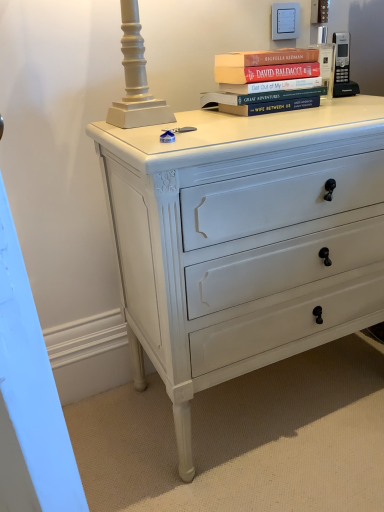
Question: Can you confirm if black plastic phone at upper right is positioned to the right of white painted wood chest of drawers at center?

Choices:
 (A) no
 (B) yes

Answer: (B)

Question: From the image's perspective, is black plastic phone at upper right below white painted wood chest of drawers at center?

Choices:
 (A) yes
 (B) no

Answer: (B)

Question: Would you say black plastic phone at upper right contains white painted wood chest of drawers at center?

Choices:
 (A) yes
 (B) no

Answer: (B)

Question: From the image's perspective, is black plastic phone at upper right located above white painted wood chest of drawers at center?

Choices:
 (A) yes
 (B) no

Answer: (A)

Question: Is black plastic phone at upper right positioned with its back to white painted wood chest of drawers at center?

Choices:
 (A) yes
 (B) no

Answer: (B)

Question: Is point (337, 91) closer or farther from the camera than point (309, 53)?

Choices:
 (A) farther
 (B) closer

Answer: (A)

Question: Based on their sizes in the image, would you say black plastic phone at upper right is bigger or smaller than hardcover books at upper center?

Choices:
 (A) big
 (B) small

Answer: (B)

Question: Would you say black plastic phone at upper right is inside or outside hardcover books at upper center?

Choices:
 (A) inside
 (B) outside

Answer: (B)

Question: Considering the relative positions of black plastic phone at upper right and hardcover books at upper center in the image provided, is black plastic phone at upper right to the left or to the right of hardcover books at upper center?

Choices:
 (A) left
 (B) right

Answer: (B)

Question: Considering their positions, is hardcover books at upper center located in front of or behind black plastic phone at upper right?

Choices:
 (A) front
 (B) behind

Answer: (A)

Question: Is hardcover books at upper center bigger or smaller than black plastic phone at upper right?

Choices:
 (A) small
 (B) big

Answer: (B)

Question: From a real-world perspective, relative to black plastic phone at upper right, is hardcover books at upper center vertically above or below?

Choices:
 (A) below
 (B) above

Answer: (A)

Question: Is point (261, 79) closer or farther from the camera than point (337, 72)?

Choices:
 (A) farther
 (B) closer

Answer: (B)

Question: Is black plastic phone at upper right inside the boundaries of white painted wood chest of drawers at center, or outside?

Choices:
 (A) outside
 (B) inside

Answer: (A)

Question: Considering the relative positions of black plastic phone at upper right and white painted wood chest of drawers at center in the image provided, is black plastic phone at upper right to the left or to the right of white painted wood chest of drawers at center?

Choices:
 (A) left
 (B) right

Answer: (B)